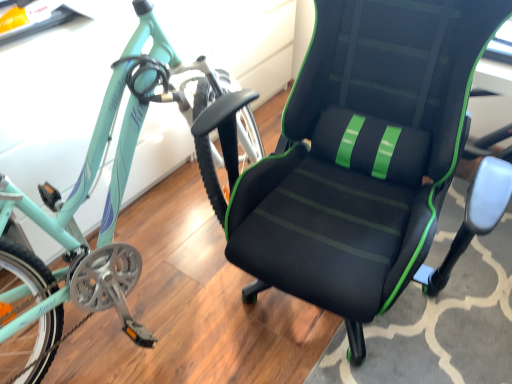
Question: From a real-world perspective, is black mesh chair at center beneath teal matte bicycle at left?

Choices:
 (A) no
 (B) yes

Answer: (A)

Question: Considering the relative sizes of black mesh chair at center and teal matte bicycle at left in the image provided, is black mesh chair at center smaller than teal matte bicycle at left?

Choices:
 (A) no
 (B) yes

Answer: (B)

Question: Can you confirm if black mesh chair at center is positioned to the right of teal matte bicycle at left?

Choices:
 (A) yes
 (B) no

Answer: (A)

Question: Is black mesh chair at center next to teal matte bicycle at left and touching it?

Choices:
 (A) yes
 (B) no

Answer: (B)

Question: Is black mesh chair at center bigger than teal matte bicycle at left?

Choices:
 (A) yes
 (B) no

Answer: (B)

Question: From a real-world perspective, is black mesh chair at center physically above teal matte bicycle at left?

Choices:
 (A) yes
 (B) no

Answer: (A)

Question: From the image's perspective, is teal matte bicycle at left under black mesh chair at center?

Choices:
 (A) yes
 (B) no

Answer: (B)

Question: Is teal matte bicycle at left positioned beyond the bounds of black mesh chair at center?

Choices:
 (A) yes
 (B) no

Answer: (A)

Question: From a real-world perspective, is teal matte bicycle at left on top of black mesh chair at center?

Choices:
 (A) no
 (B) yes

Answer: (A)

Question: From the image's perspective, would you say teal matte bicycle at left is positioned over black mesh chair at center?

Choices:
 (A) no
 (B) yes

Answer: (B)

Question: Is teal matte bicycle at left surrounding black mesh chair at center?

Choices:
 (A) no
 (B) yes

Answer: (A)

Question: Is teal matte bicycle at left taller than black mesh chair at center?

Choices:
 (A) yes
 (B) no

Answer: (B)

Question: Is point (437, 175) closer or farther from the camera than point (116, 175)?

Choices:
 (A) closer
 (B) farther

Answer: (A)